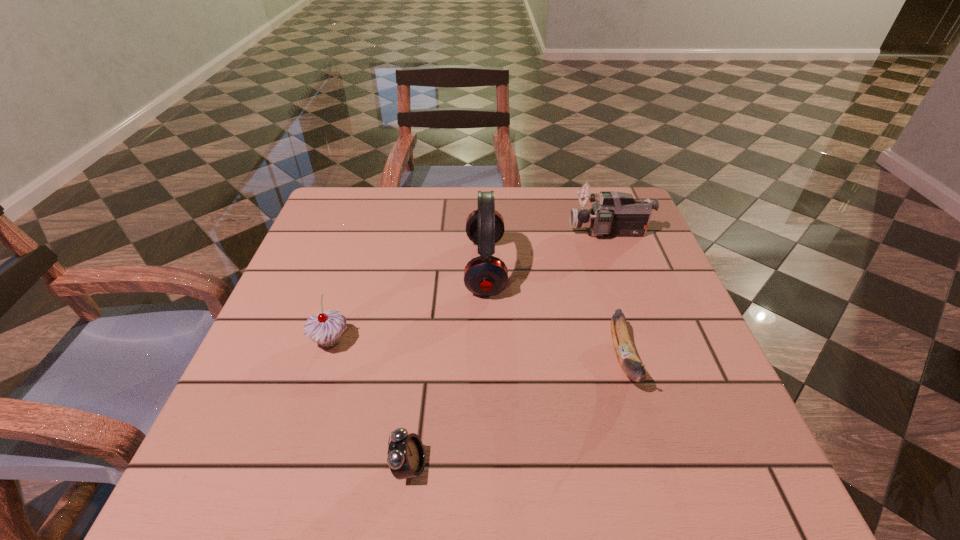
Image resolution: width=960 pixels, height=540 pixels. I want to click on free spot located 0.070m on the front-facing side of the camcorder, so click(x=542, y=232).

Identify the location of vacant space situated on the front-facing side of the camcorder. Image resolution: width=960 pixels, height=540 pixels. (455, 232).

Where is `vacant space located on the front-facing side of the camcorder`? This screenshot has width=960, height=540. vacant space located on the front-facing side of the camcorder is located at coordinates (444, 232).

Image resolution: width=960 pixels, height=540 pixels. Find the location of `vacant space located 0.380m on the back of the leftmost object`. vacant space located 0.380m on the back of the leftmost object is located at coordinates (370, 218).

Where is `vacant region located 0.100m at the stem of the banana`? The image size is (960, 540). vacant region located 0.100m at the stem of the banana is located at coordinates (653, 454).

You are a GUI agent. You are given a task and a screenshot of the screen. Output one action in this format:
    pyautogui.click(x=<x>, y=<y>)
    Task: Click on the vacant space situated on the face of the nearest object
    Image resolution: width=960 pixels, height=540 pixels.
    Given the screenshot: What is the action you would take?
    pyautogui.click(x=629, y=467)

This screenshot has width=960, height=540. Find the location of `earphone that is at the far edge`. earphone that is at the far edge is located at coordinates (485, 275).

This screenshot has width=960, height=540. In order to click on camcorder located at the far edge in this screenshot , I will do `click(614, 214)`.

This screenshot has width=960, height=540. I want to click on object situated at the near edge, so click(x=406, y=456).

Where is `object present at the left edge`? The width and height of the screenshot is (960, 540). object present at the left edge is located at coordinates (325, 328).